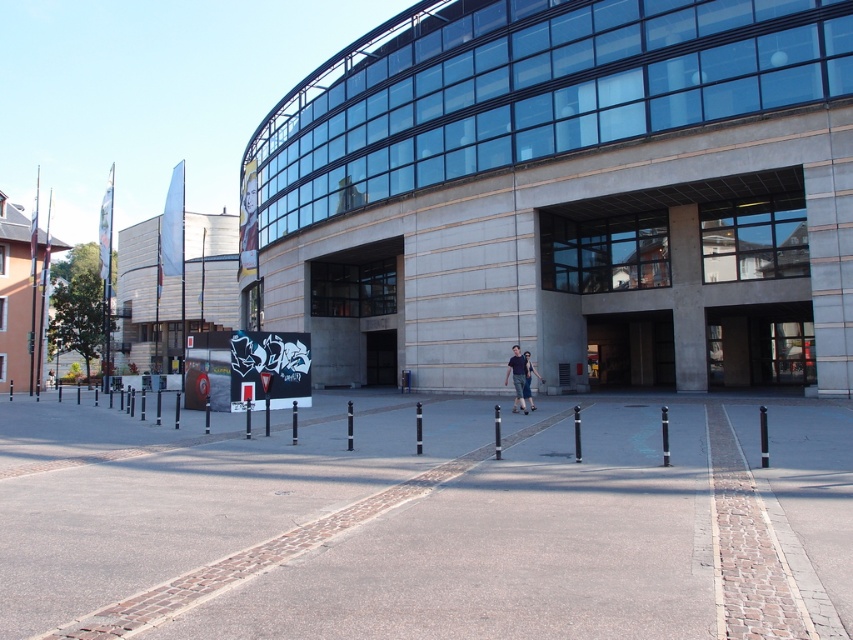
Question: Observing the image, what is the correct spatial positioning of denim pants at center in reference to dark blue jeans at center?

Choices:
 (A) above
 (B) below

Answer: (B)

Question: Does denim pants at center appear on the right side of dark blue jeans at center?

Choices:
 (A) yes
 (B) no

Answer: (B)

Question: Can you confirm if denim pants at center is wider than dark blue jeans at center?

Choices:
 (A) no
 (B) yes

Answer: (A)

Question: Among these points, which one is farthest from the camera?

Choices:
 (A) (526, 376)
 (B) (515, 406)

Answer: (B)